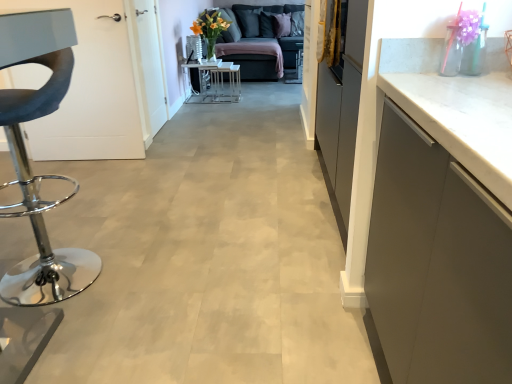
Question: Looking at the image, does metallic chrome stool at left seem bigger or smaller compared to dark gray fabric couch at upper center?

Choices:
 (A) big
 (B) small

Answer: (B)

Question: In terms of height, does metallic chrome stool at left look taller or shorter compared to dark gray fabric couch at upper center?

Choices:
 (A) tall
 (B) short

Answer: (A)

Question: Which of these objects is positioned farthest from the metallic chrome stool at left?

Choices:
 (A) dark gray fabric couch at upper center
 (B) metallic silver table at center

Answer: (A)

Question: Based on their relative distances, which object is nearer to the metallic silver table at center?

Choices:
 (A) metallic chrome stool at left
 (B) dark gray fabric couch at upper center

Answer: (B)